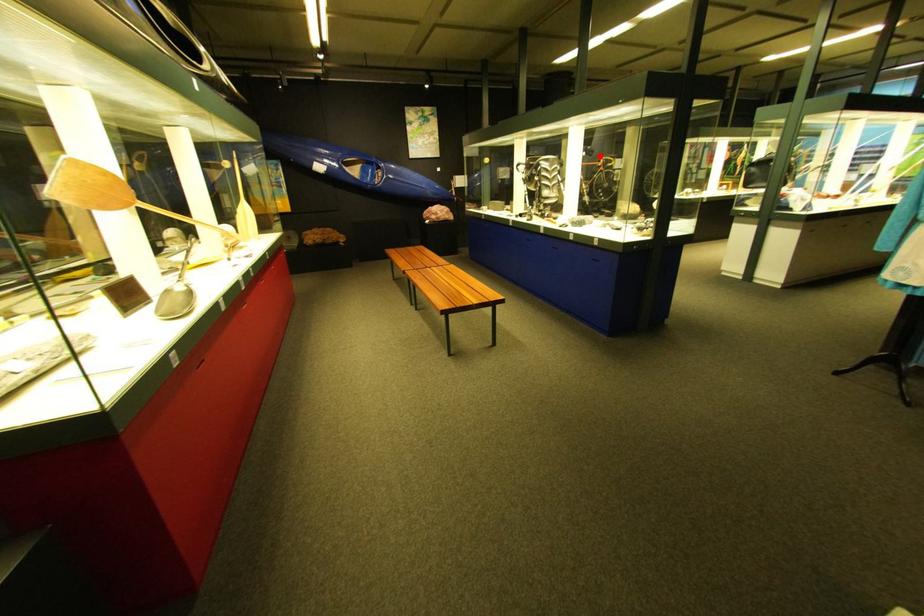
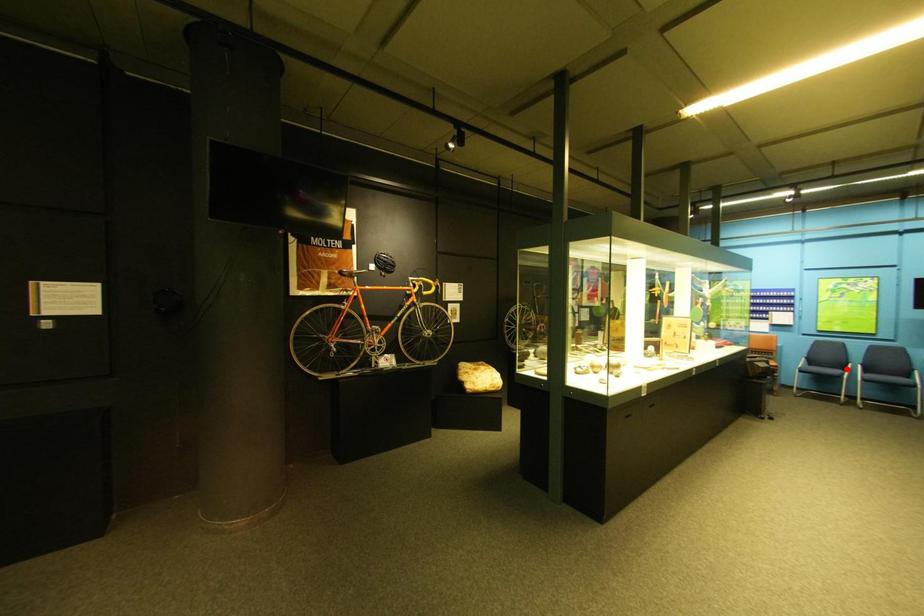
I am providing you with two images of the same scene from different viewpoints. A red point is marked on the first image and another point is marked on the second image. Is the red point in image1 aligned with the point shown in image2?

No